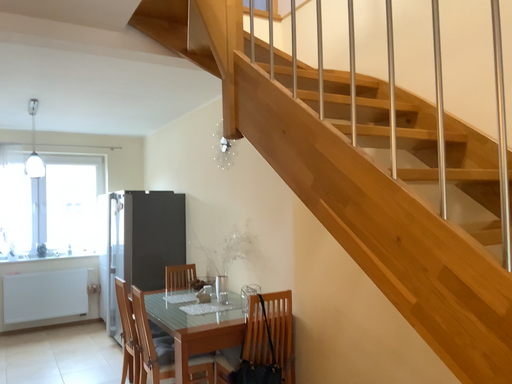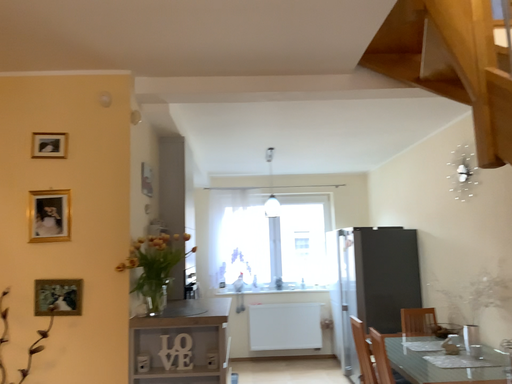
Question: Which way did the camera rotate in the video?

Choices:
 (A) rotated left
 (B) rotated right

Answer: (A)